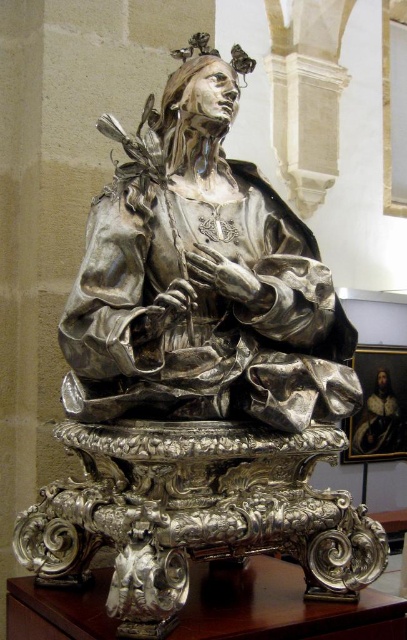
You are an art conservator tasked with placing a protective glass case around the shiny silver statue at center. The case must be positioned precisely at the statue. What are the coordinates where you should center the glass case?

The coordinates for the shiny silver statue at center are at point (201, 278). Therefore, the glass case should be centered at those coordinates to ensure proper placement around the statue.

You are a museum curator standing in front of the shiny silver statue at center. You need to clean it with a cloth that can only reach 4 feet. Can you clean the statue without moving closer?

The shiny silver statue at center is 4.62 feet away from the viewer, which is beyond the 4 feet reach of the cloth. Therefore, you cannot clean the statue without moving closer.